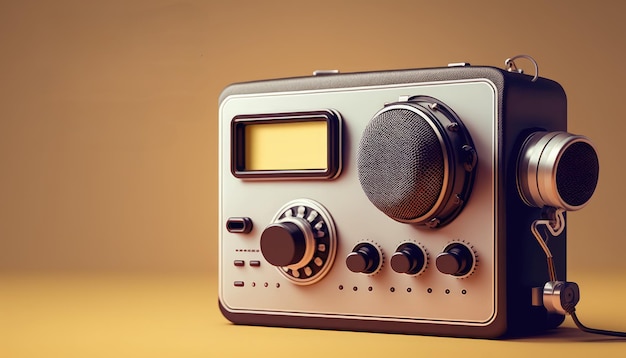
You are a GUI agent. You are given a task and a screenshot of the screen. Output one action in this format:
    pyautogui.click(x=<x>, y=<y>)
    Task: Click on the small knobs
    This screenshot has height=358, width=626.
    Given the screenshot: What is the action you would take?
    pyautogui.click(x=370, y=259), pyautogui.click(x=394, y=258), pyautogui.click(x=449, y=257)